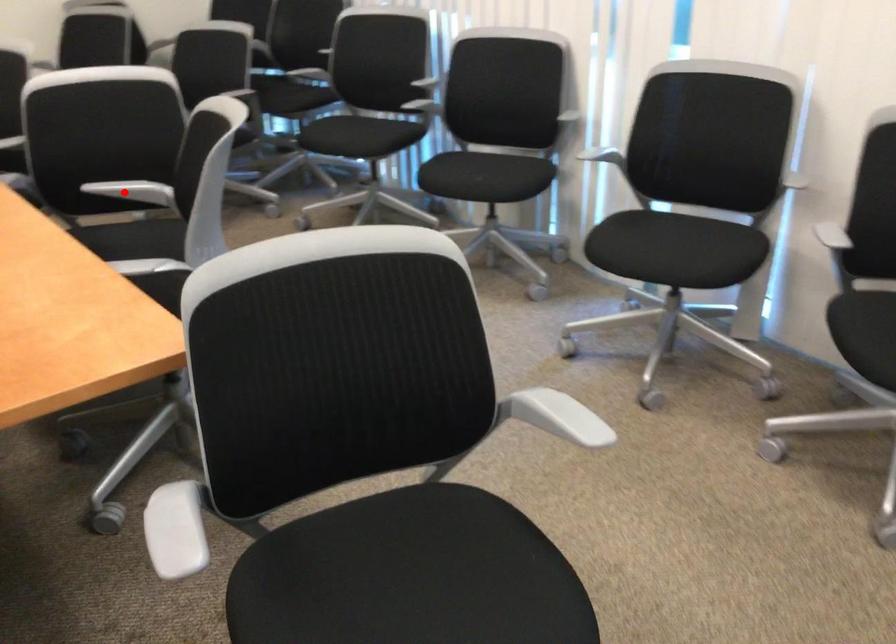
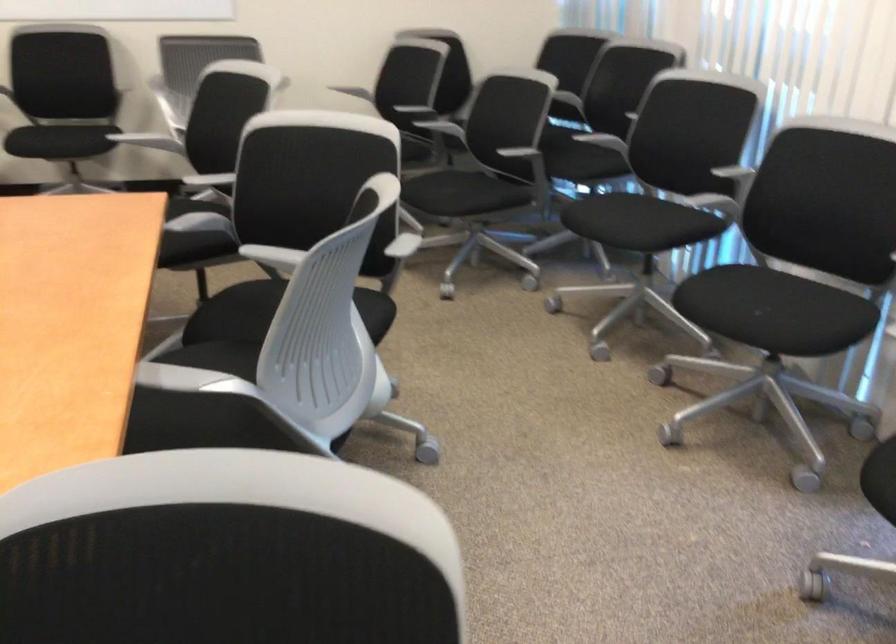
Question: I am providing you with two images of the same scene from different viewpoints. Image1 has a red point marked. In image2, the corresponding 3D location appears at what relative position? Reply with the corresponding letter.

Choices:
 (A) Closer
 (B) Farther

Answer: (A)